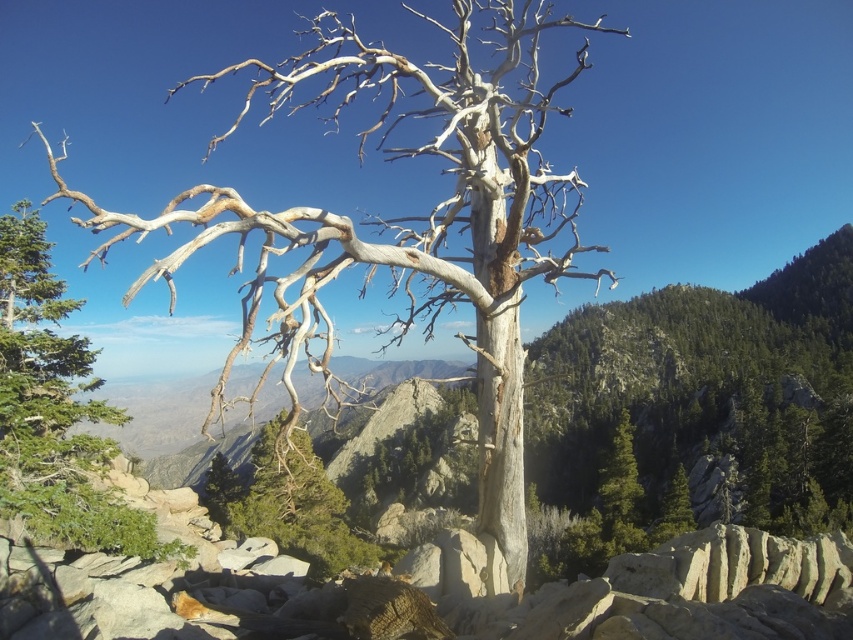
You are an artist planning to paint this scene. You want to emphasize the size difference between the gray bark tree at center and the gray bark tree at upper left. Which tree should you paint wider in your artwork?

You should paint the gray bark tree at center wider because its width is larger than the gray bark tree at upper left.

You are an artist sketching this scene and want to place the gray bark tree at center accurately. According to the coordinates provided, where should you position the tree on your paper grid that ranges from 0 to 1 in both x and y axes?

The gray bark tree at center should be positioned at the coordinates 0.339 on the x axis and 0.475 on the y axis.

You are a hiker who wants to take a photo of the gray bark tree at center and the gray bark tree at upper left. Which tree should you stand closer to in order to capture both in a single frame without zooming?

You should stand closer to the gray bark tree at upper left since it is shorter than the gray bark tree at center, allowing both to fit in the frame when positioned appropriately.